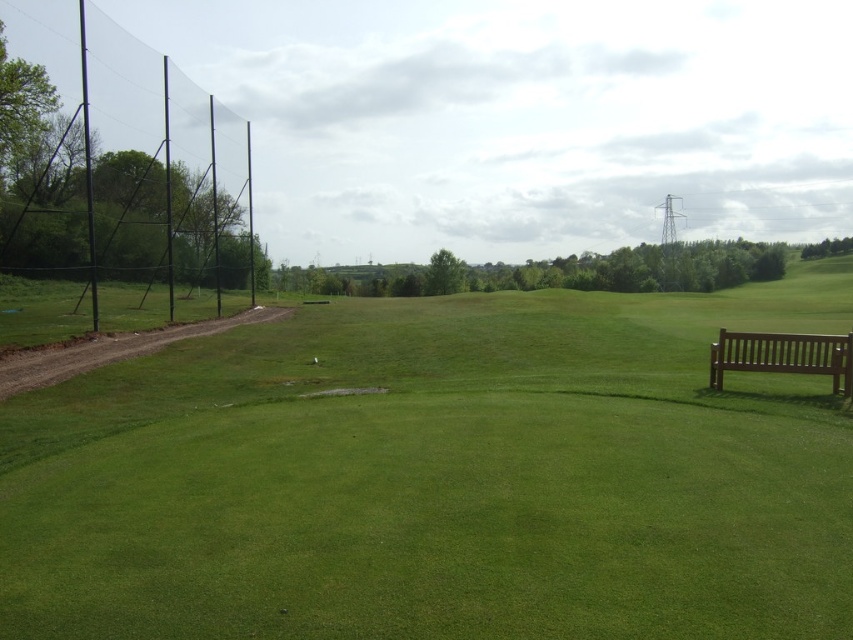
You are standing at the origin point of the coordinate system in the image. You want to walk to the green smooth grass at center. Which direction should you move in terms of the coordinate system?

Since the green smooth grass at center is located at coordinate point (440, 476), you should move towards the positive x direction from the origin point to reach it.

You are standing at the point marked as point (440, 476) in the image. Based on the scene description, what type of terrain are you currently standing on?

The point (440, 476) is on green smooth grass at center, so you are standing on green smooth grass.

You are a gardener planning to water the green smooth grass at center and the brown wooden bench at right. Since the water hose can only reach 2 meters, and you are standing at the edge of the field near the dirt path, which object can you reach first without moving your position?

The brown wooden bench at right is positioned to the right of the green smooth grass at center. Since you are near the dirt path on the left, the brown wooden bench at right is closer to you and can be reached first within the 2 meter hose range.